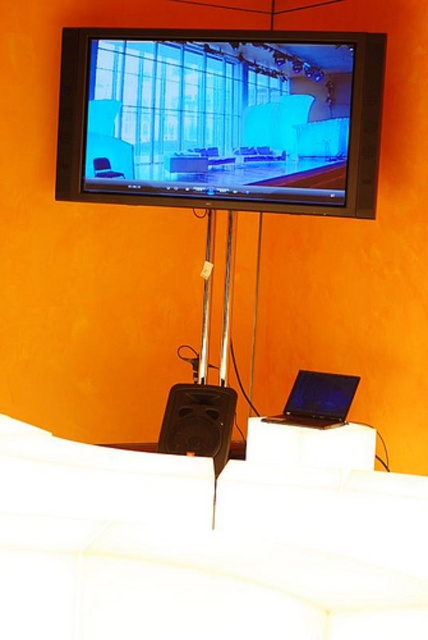
You are sitting on the white fabric couch at lower center and want to reach the black matte laptop at lower center. In which direction should you move to get to the laptop?

You should move to the right to reach the black matte laptop at lower center because the white fabric couch at lower center is to the left of it.